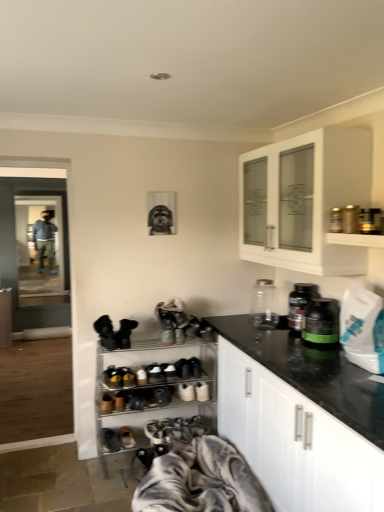
Where is `vacant area to the left of black plastic bottle at upper right`? The image size is (384, 512). vacant area to the left of black plastic bottle at upper right is located at coordinates (274, 334).